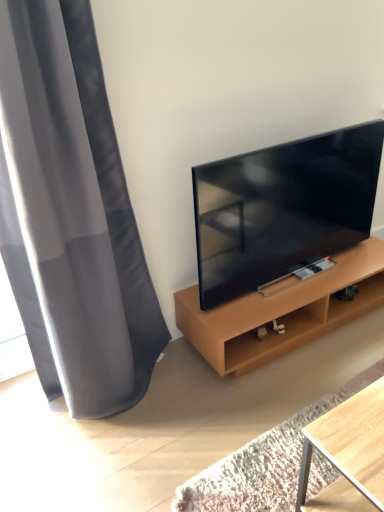
Locate an element on the screen. The height and width of the screenshot is (512, 384). free spot in front of wooden shelf at right is located at coordinates (273, 406).